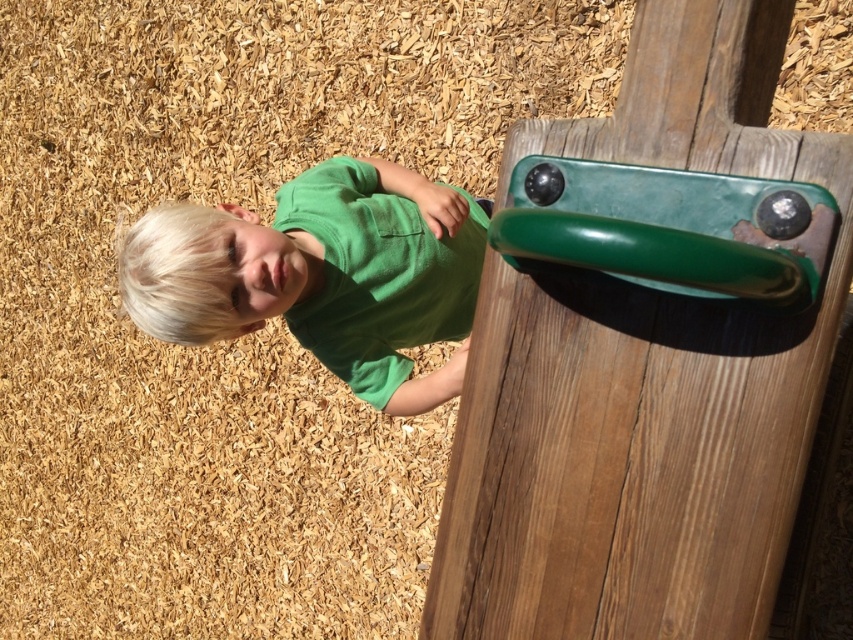
You are a child trying to grab both the green glossy handle at upper right and the green matte shirt at center. Which one do you think will be harder to grip?

The green glossy handle at upper right will be harder to grip because its width is less than the green matte shirt at center.

You are a parent trying to ensure your child stays within a safe distance from the playground equipment. The child is wearing a green matte shirt at center and is near a green glossy handle at upper right. Which object is located to the right of the child?

The green glossy handle at upper right is positioned on the right side of the green matte shirt at center, so the green glossy handle at upper right is to the right of the child.